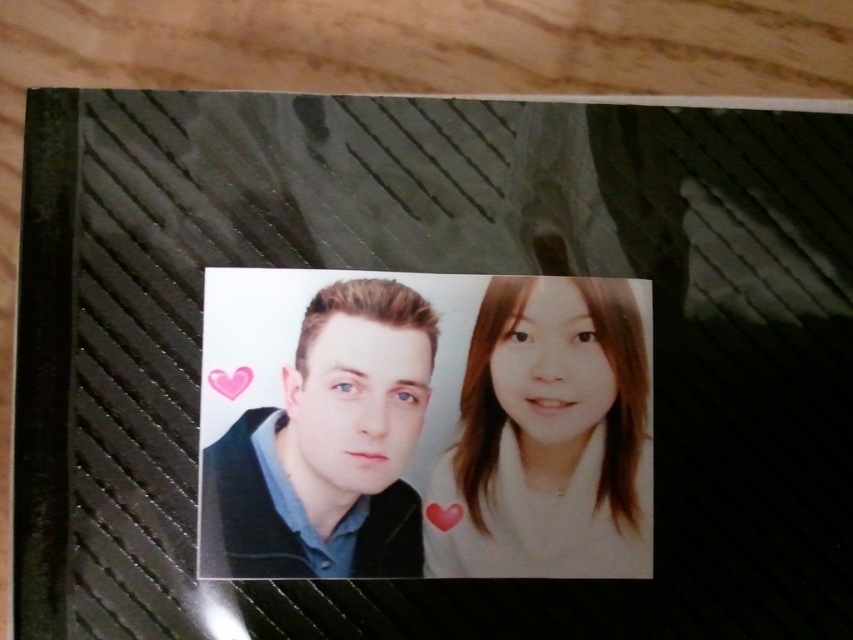
Where is the white matte hair at center located in the image?

The white matte hair at center is located at point (x=548, y=436).

You are a photographer organizing a photo album and notice the white matte hair at center and the matte black sweater at center in the photo. Which object in the photo is closer to the camera?

The white matte hair at center is closer to the camera than the matte black sweater at center because the sweater is positioned behind the hair.

Looking at the photograph on the textured surface, you notice the white matte hair at center and the matte black sweater at center. Which object is positioned to the right of the other?

The white matte hair at center is to the right of the matte black sweater at center.